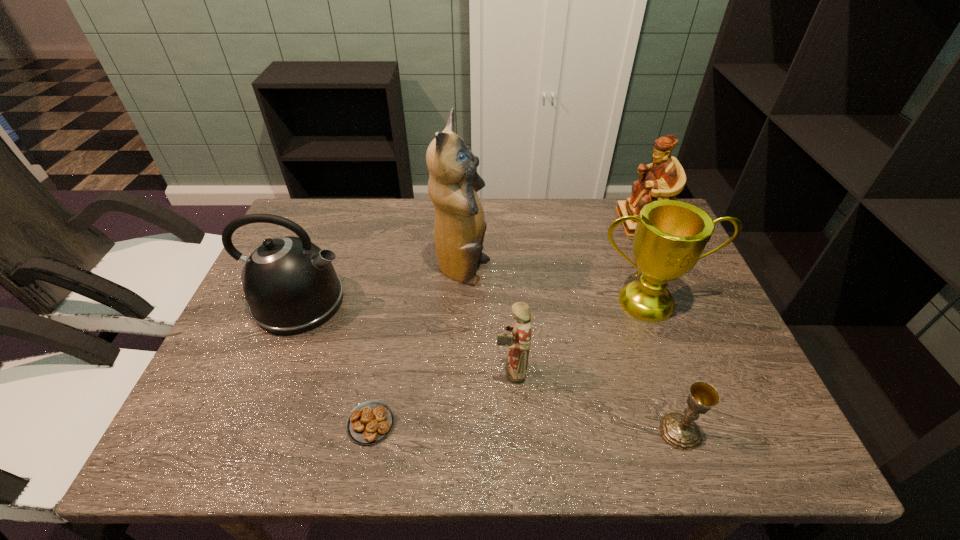
Find the location of `vacant space that satisfies the following two spatial constraints: 1. on the shiny surface of the award; 2. on the front-facing side of the third nearest object`. vacant space that satisfies the following two spatial constraints: 1. on the shiny surface of the award; 2. on the front-facing side of the third nearest object is located at coordinates coord(674,371).

Locate an element on the screen. Image resolution: width=960 pixels, height=540 pixels. blank space that satisfies the following two spatial constraints: 1. on the shiny surface of the award; 2. on the spout of the leftmost object is located at coordinates (648, 302).

The height and width of the screenshot is (540, 960). Find the location of `free region that satisfies the following two spatial constraints: 1. on the face of the chalice; 2. on the left side of the third object from left to right`. free region that satisfies the following two spatial constraints: 1. on the face of the chalice; 2. on the left side of the third object from left to right is located at coordinates (456, 431).

Where is `free location that satisfies the following two spatial constraints: 1. on the front-facing side of the chalice; 2. on the right side of the fifth farthest object`? The height and width of the screenshot is (540, 960). free location that satisfies the following two spatial constraints: 1. on the front-facing side of the chalice; 2. on the right side of the fifth farthest object is located at coordinates (515, 431).

You are a GUI agent. You are given a task and a screenshot of the screen. Output one action in this format:
    pyautogui.click(x=<x>, y=<y>)
    Task: Click on the free space that satisfies the following two spatial constraints: 1. on the front-facing side of the sixth tallest object; 2. on the left side of the fifth tallest object
    Image resolution: width=960 pixels, height=540 pixels.
    Given the screenshot: What is the action you would take?
    pyautogui.click(x=515, y=431)

I want to click on vacant area that satisfies the following two spatial constraints: 1. on the face of the cat; 2. on the front side of the pastry, so click(456, 423).

The image size is (960, 540). I want to click on free spot that satisfies the following two spatial constraints: 1. on the spout of the kettle; 2. on the back side of the shortest object, so click(250, 423).